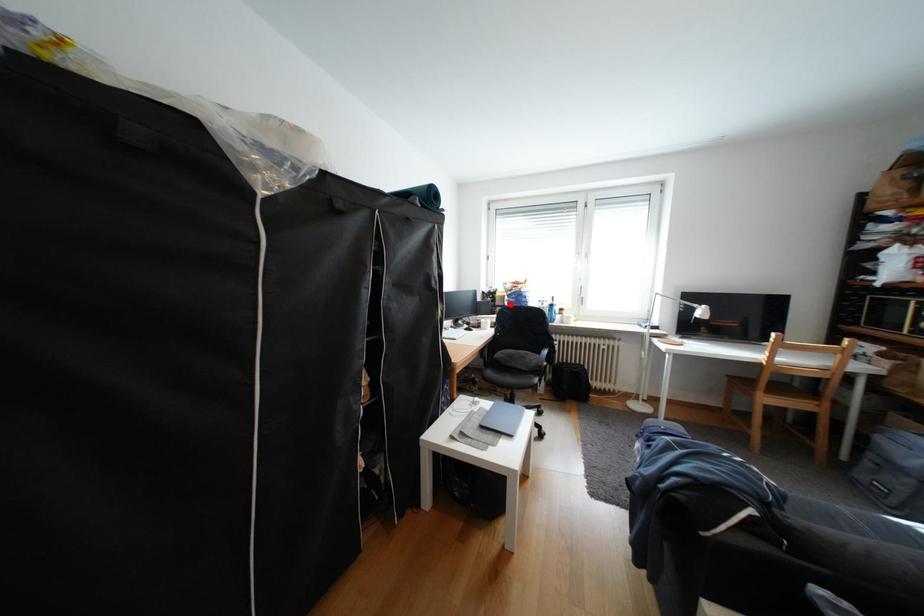
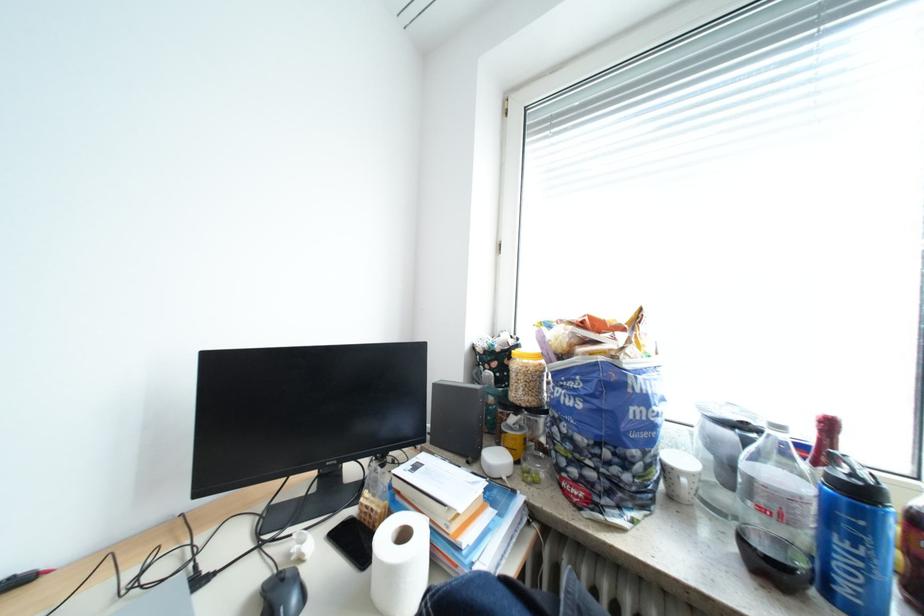
In the second image, find the point that corresponds to the highlighted location in the first image.

(529, 394)